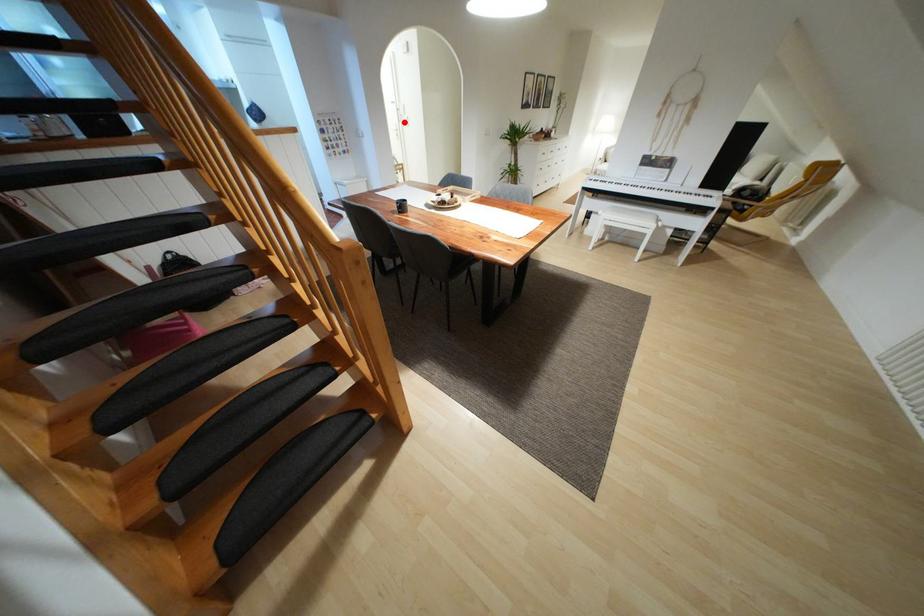
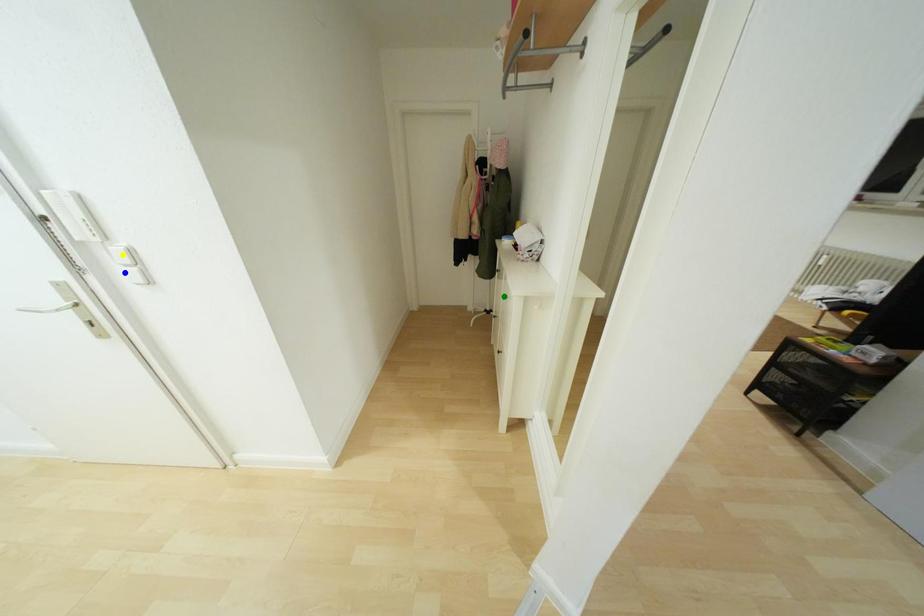
Question: I am providing you with two images of the same scene from different viewpoints. A red point is marked on the first image. You are given multiple points on the second image. Which point in image 2 represents the same 3d spot as the red point in image 1?

Choices:
 (A) yellow point
 (B) blue point
 (C) green point

Answer: (B)